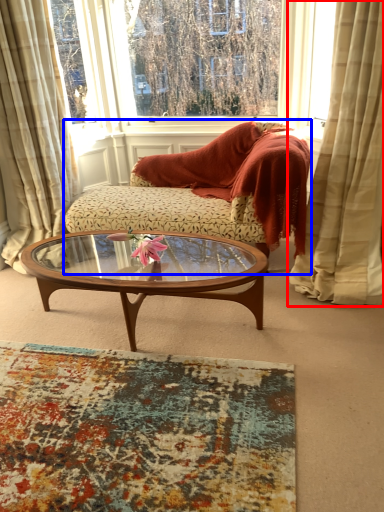
Question: Which object is closer to the camera taking this photo, curtain (highlighted by a red box) or studio couch (highlighted by a blue box)?

Choices:
 (A) curtain
 (B) studio couch

Answer: (A)